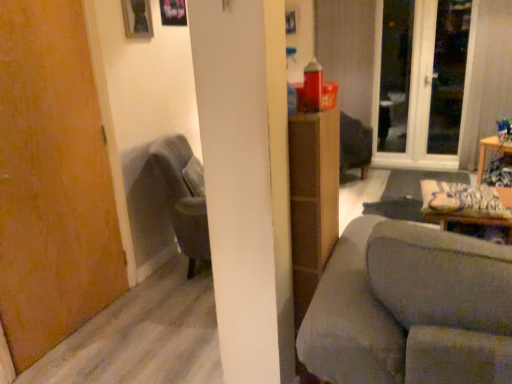
Question: Does gray fabric couch at center come behind velvet grey armchair at left?

Choices:
 (A) yes
 (B) no

Answer: (B)

Question: Is gray fabric couch at center outside velvet grey armchair at left?

Choices:
 (A) yes
 (B) no

Answer: (A)

Question: Considering the relative sizes of gray fabric couch at center and velvet grey armchair at left in the image provided, is gray fabric couch at center taller than velvet grey armchair at left?

Choices:
 (A) no
 (B) yes

Answer: (B)

Question: Is gray fabric couch at center closer to camera compared to velvet grey armchair at left?

Choices:
 (A) yes
 (B) no

Answer: (A)

Question: From a real-world perspective, does gray fabric couch at center stand above velvet grey armchair at left?

Choices:
 (A) no
 (B) yes

Answer: (A)

Question: Is white glass screen door at upper right inside the boundaries of wooden table at right, or outside?

Choices:
 (A) outside
 (B) inside

Answer: (A)

Question: Looking at their shapes, would you say white glass screen door at upper right is wider or thinner than wooden table at right?

Choices:
 (A) wide
 (B) thin

Answer: (B)

Question: In terms of height, does white glass screen door at upper right look taller or shorter compared to wooden table at right?

Choices:
 (A) short
 (B) tall

Answer: (B)

Question: Is point (451, 165) positioned closer to the camera than point (487, 145)?

Choices:
 (A) closer
 (B) farther

Answer: (B)

Question: Is wooden table at right bigger or smaller than velvet grey armchair at left?

Choices:
 (A) big
 (B) small

Answer: (B)

Question: From the image's perspective, is wooden table at right located above or below velvet grey armchair at left?

Choices:
 (A) below
 (B) above

Answer: (B)

Question: Considering the positions of wooden table at right and velvet grey armchair at left in the image, is wooden table at right wider or thinner than velvet grey armchair at left?

Choices:
 (A) thin
 (B) wide

Answer: (B)

Question: Considering the positions of point (497, 150) and point (184, 147), is point (497, 150) closer or farther from the camera than point (184, 147)?

Choices:
 (A) closer
 (B) farther

Answer: (B)

Question: From a real-world perspective, is wooden table at right positioned above or below transparent glass window at upper right?

Choices:
 (A) below
 (B) above

Answer: (A)

Question: From the image's perspective, is wooden table at right above or below transparent glass window at upper right?

Choices:
 (A) below
 (B) above

Answer: (A)